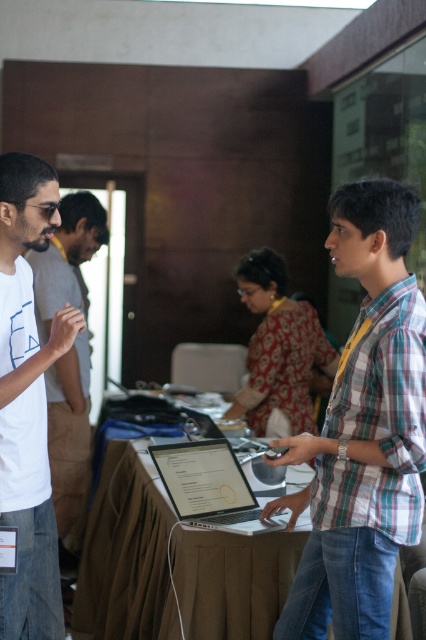
Question: Among these points, which one is nearest to the camera?

Choices:
 (A) (348, 369)
 (B) (17, 362)
 (C) (135, 547)

Answer: (A)

Question: Where is light brown fabric table at center located in relation to white matte t-shirt at left in the image?

Choices:
 (A) right
 (B) left

Answer: (A)

Question: Which object is farther from the camera taking this photo?

Choices:
 (A) plaid cotton shirt at center
 (B) light brown fabric table at center

Answer: (B)

Question: Which of the following is the closest to the observer?

Choices:
 (A) (288, 572)
 (B) (344, 596)
 (C) (20, 202)

Answer: (B)

Question: From the image, what is the correct spatial relationship of plaid cotton shirt at center in relation to light brown fabric table at center?

Choices:
 (A) right
 (B) left

Answer: (A)

Question: Is plaid cotton shirt at center above light brown fabric table at center?

Choices:
 (A) no
 (B) yes

Answer: (B)